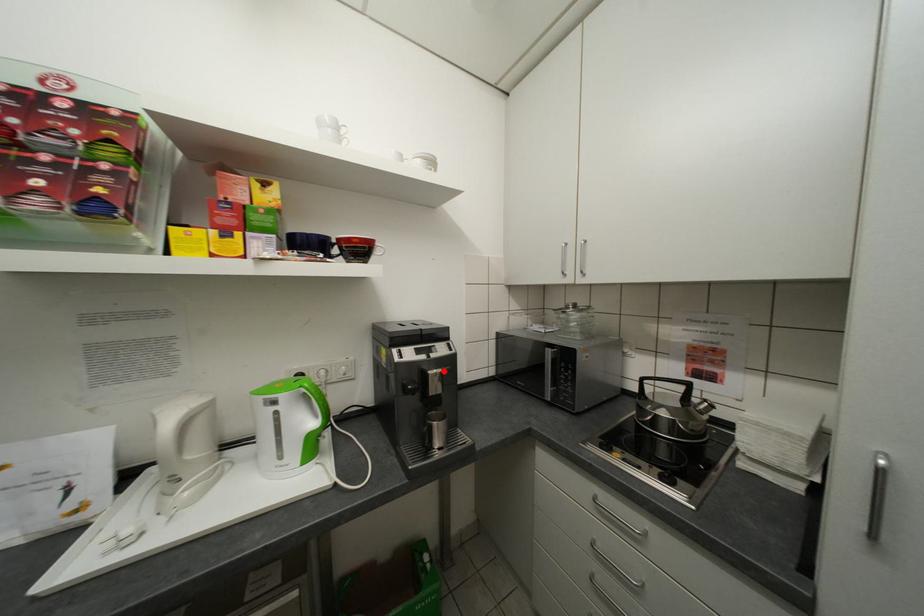
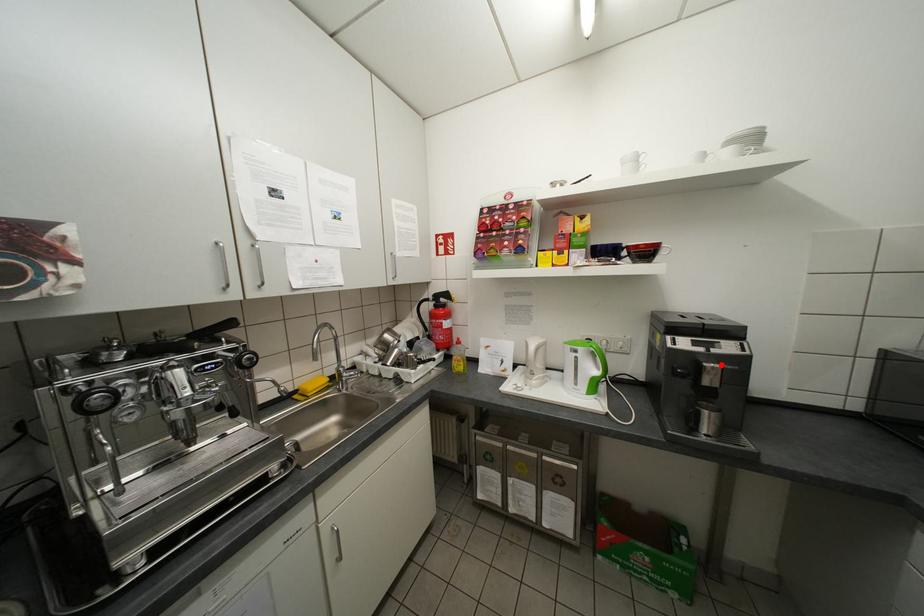
I am providing you with two images of the same scene from different viewpoints. A red point is marked on the first image and another point is marked on the second image. Is the marked point in image1 the same physical position as the marked point in image2?

Yes